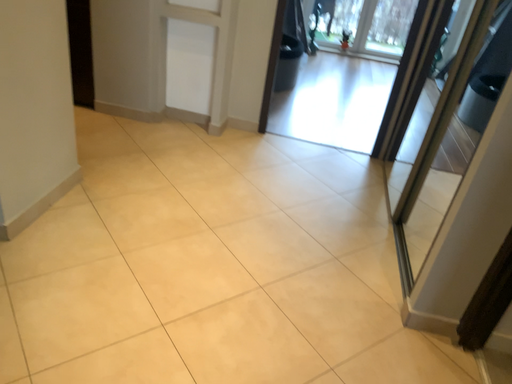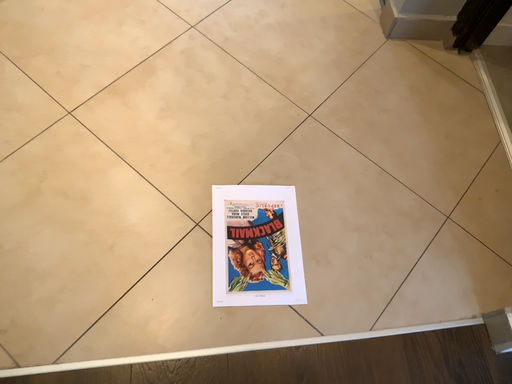
Question: How did the camera likely rotate when shooting the video?

Choices:
 (A) rotated upward
 (B) rotated downward

Answer: (B)